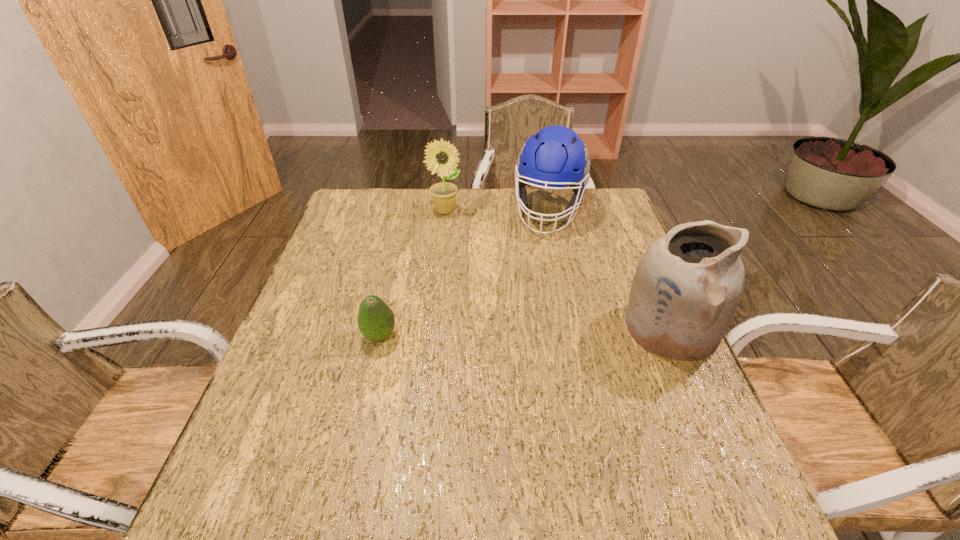
Find the location of a particular element. free space on the desktop that is between the shortest object and the rightmost object and is positioned on the face guard of the football helmet is located at coordinates (516, 332).

Locate an element on the screen. free spot on the desktop that is between the shortest object and the rightmost object and is positioned on the face of the third object from right to left is located at coordinates (550, 331).